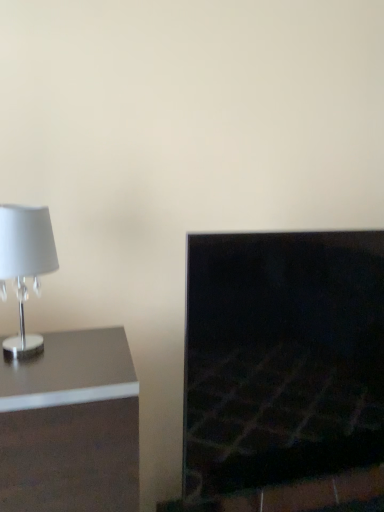
Where is `satin silver lamp at left`? satin silver lamp at left is located at coordinates (71, 426).

Based on the photo, in order to face dark stone fireplace at right, should I rotate leftwards or rightwards?

You should look right and rotate roughly 16.780 degrees.

Where is `satin silver lamp at left`? This screenshot has height=512, width=384. satin silver lamp at left is located at coordinates (71, 426).

Do you think satin silver lamp at left is within white glossy lampshade at left, or outside of it?

satin silver lamp at left is spatially situated outside white glossy lampshade at left.

Which of these two, satin silver lamp at left or white glossy lampshade at left, is smaller?

Smaller between the two is white glossy lampshade at left.

From the picture: From the image's perspective, is satin silver lamp at left located beneath white glossy lampshade at left?

Indeed, from the image's perspective, satin silver lamp at left is shown beneath white glossy lampshade at left.

Looking at the image, does dark stone fireplace at right seem bigger or smaller compared to satin silver lamp at left?

In the image, dark stone fireplace at right appears to be smaller than satin silver lamp at left.

Is dark stone fireplace at right at the right side of satin silver lamp at left?

Yes, dark stone fireplace at right is to the right of satin silver lamp at left.

From the image's perspective, would you say dark stone fireplace at right is positioned over satin silver lamp at left?

Yes, from the image's perspective, dark stone fireplace at right is on top of satin silver lamp at left.

In order to click on furniture below the dark stone fireplace at right (from a real-world perspective) in this screenshot , I will do `click(71, 426)`.

Is satin silver lamp at left bigger than dark stone fireplace at right?

Yes, satin silver lamp at left is bigger than dark stone fireplace at right.

Is satin silver lamp at left to the right of dark stone fireplace at right from the viewer's perspective?

No, satin silver lamp at left is not to the right of dark stone fireplace at right.

Would you say dark stone fireplace at right is part of satin silver lamp at left's contents?

No.

Would you say white glossy lampshade at left is to the left or to the right of satin silver lamp at left in the picture?

white glossy lampshade at left is positioned on satin silver lamp at left's left side.

Is point (28, 261) closer or farther from the camera than point (42, 440)?

Point (28, 261) is positioned farther from the camera compared to point (42, 440).

Is satin silver lamp at left at the back of white glossy lampshade at left?

No, white glossy lampshade at left is not facing the opposite direction of satin silver lamp at left.

Is white glossy lampshade at left further to camera compared to satin silver lamp at left?

Yes, the depth of white glossy lampshade at left is greater than that of satin silver lamp at left.

Does dark stone fireplace at right appear on the right side of white glossy lampshade at left?

Indeed, dark stone fireplace at right is positioned on the right side of white glossy lampshade at left.

Does dark stone fireplace at right contain white glossy lampshade at left?

No, white glossy lampshade at left is not inside dark stone fireplace at right.

From the image's perspective, is dark stone fireplace at right under white glossy lampshade at left?

Correct, dark stone fireplace at right appears lower than white glossy lampshade at left in the image.

Does dark stone fireplace at right turn towards white glossy lampshade at left?

No.

Can you confirm if white glossy lampshade at left is smaller than dark stone fireplace at right?

Yes.

Can you confirm if white glossy lampshade at left is wider than dark stone fireplace at right?

Yes, white glossy lampshade at left is wider than dark stone fireplace at right.

Considering the relative sizes of white glossy lampshade at left and dark stone fireplace at right in the image provided, is white glossy lampshade at left shorter than dark stone fireplace at right?

Correct, white glossy lampshade at left is not as tall as dark stone fireplace at right.

Is white glossy lampshade at left oriented away from dark stone fireplace at right?

No.

Find the location of a particular element. The width and height of the screenshot is (384, 512). lamp above the satin silver lamp at left (from the image's perspective) is located at coordinates (25, 266).

You are a GUI agent. You are given a task and a screenshot of the screen. Output one action in this format:
    pyautogui.click(x=<x>, y=<y>)
    Task: Click on the furniture that appears below the dark stone fireplace at right (from the image's perspective)
    This screenshot has width=384, height=512.
    Given the screenshot: What is the action you would take?
    pyautogui.click(x=71, y=426)

Based on their spatial positions, is dark stone fireplace at right or white glossy lampshade at left further from satin silver lamp at left?

dark stone fireplace at right is positioned further to the anchor satin silver lamp at left.

Estimate the real-world distances between objects in this image. Which object is closer to satin silver lamp at left, white glossy lampshade at left or dark stone fireplace at right?

white glossy lampshade at left is positioned closer to the anchor satin silver lamp at left.

From the image, which object appears to be farther from dark stone fireplace at right, satin silver lamp at left or white glossy lampshade at left?

white glossy lampshade at left is positioned further to the anchor dark stone fireplace at right.

When comparing their distances from white glossy lampshade at left, does dark stone fireplace at right or satin silver lamp at left seem further?

Among the two, dark stone fireplace at right is located further to white glossy lampshade at left.

Based on their spatial positions, is satin silver lamp at left or dark stone fireplace at right further from white glossy lampshade at left?

Based on the image, dark stone fireplace at right appears to be further to white glossy lampshade at left.

Estimate the real-world distances between objects in this image. Which object is closer to dark stone fireplace at right, white glossy lampshade at left or satin silver lamp at left?

Based on the image, satin silver lamp at left appears to be nearer to dark stone fireplace at right.

Identify the location of furniture between white glossy lampshade at left and dark stone fireplace at right in the horizontal direction. (71, 426).